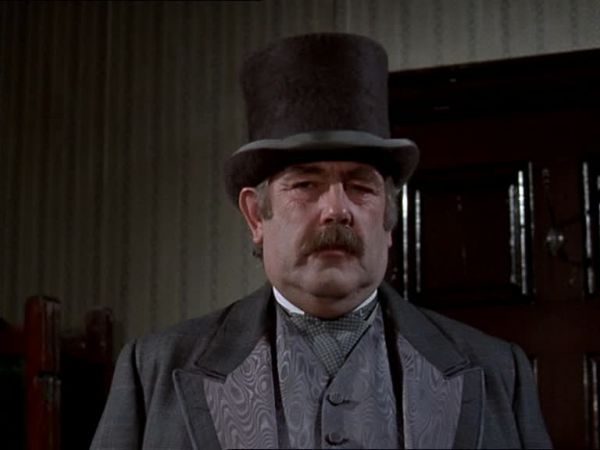
Where is `wall`? wall is located at coordinates (186, 129).